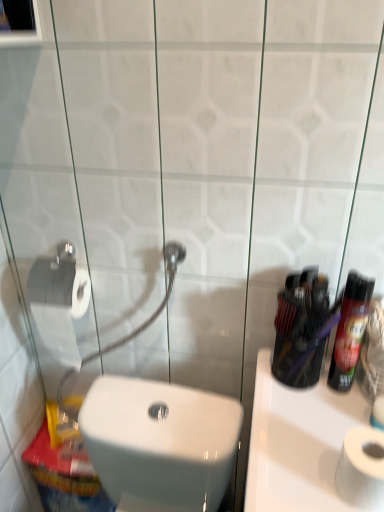
Find the location of a particular element. vacant space in front of translucent plastic mouthwash at center is located at coordinates (301, 417).